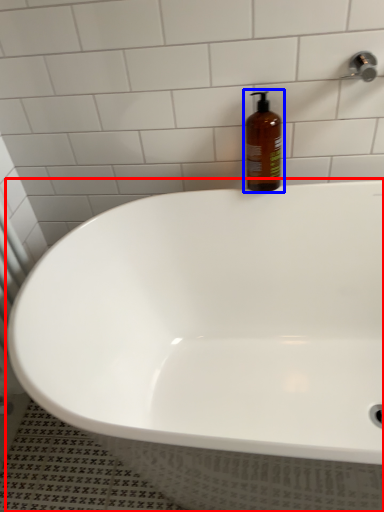
Question: Which point is further to the camera, bathtub (highlighted by a red box) or bottle (highlighted by a blue box)?

Choices:
 (A) bathtub
 (B) bottle

Answer: (B)